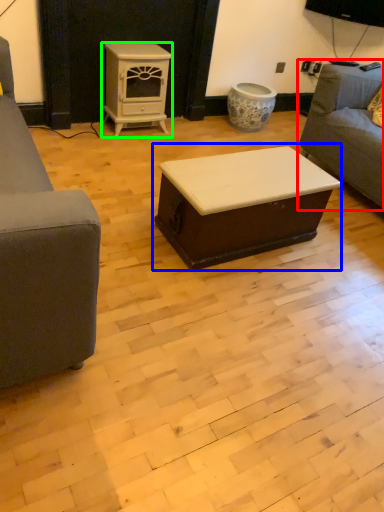
Question: Which is nearer to the studio couch (highlighted by a red box)? table (highlighted by a blue box) or appliance (highlighted by a green box).

Choices:
 (A) table
 (B) appliance

Answer: (A)